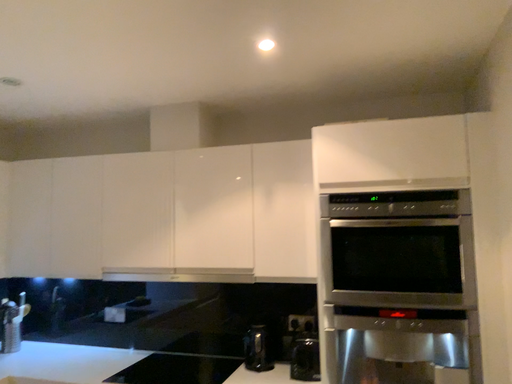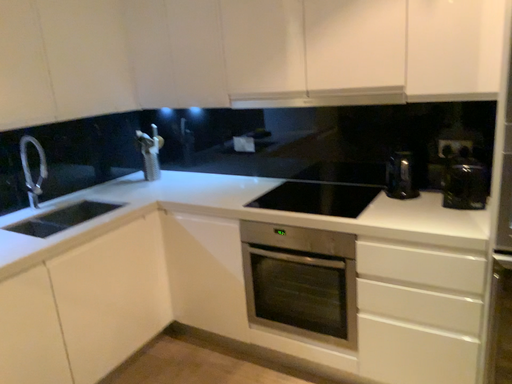
Question: Which way did the camera rotate in the video?

Choices:
 (A) rotated left
 (B) rotated right

Answer: (A)